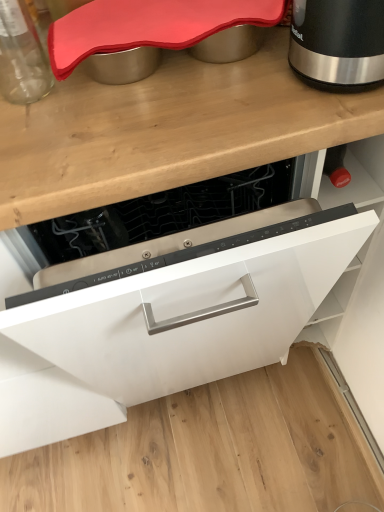
In order to click on free region under transparent glass jar at upper left (from a real-world perspective) in this screenshot , I will do `click(29, 68)`.